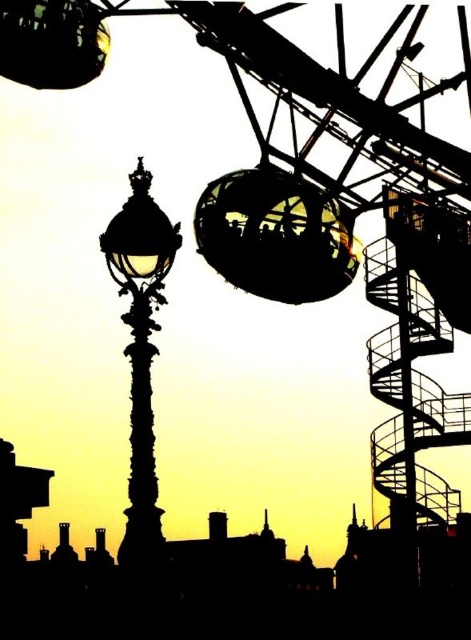
Is spiral steel staircase at right positioned behind metallic glass sphere at upper center?

That is True.

Is point (398, 460) more distant than point (270, 241)?

Yes, point (398, 460) is farther from viewer.

Locate an element on the screen. This screenshot has width=471, height=640. spiral steel staircase at right is located at coordinates (409, 394).

Does point (373, 476) come in front of point (155, 508)?

Yes, it is.

Does point (430, 410) come farther from viewer compared to point (134, 241)?

No, it is not.

Does point (419, 392) come closer to viewer compared to point (128, 248)?

Yes.

The width and height of the screenshot is (471, 640). Identify the location of spiral steel staircase at right. (409, 394).

Can you confirm if metallic glass sphere at upper center is bigger than silhouette ornate street light at left?

No.

Can you confirm if metallic glass sphere at upper center is thinner than silhouette ornate street light at left?

Incorrect, metallic glass sphere at upper center's width is not less than silhouette ornate street light at left's.

Is point (284, 221) less distant than point (145, 403)?

Yes, it is in front of point (145, 403).

At what (x,y) coordinates should I click in order to perform the action: click on metallic glass sphere at upper center. Please return your answer as a coordinate pair (x, y). This screenshot has width=471, height=640. Looking at the image, I should click on (276, 236).